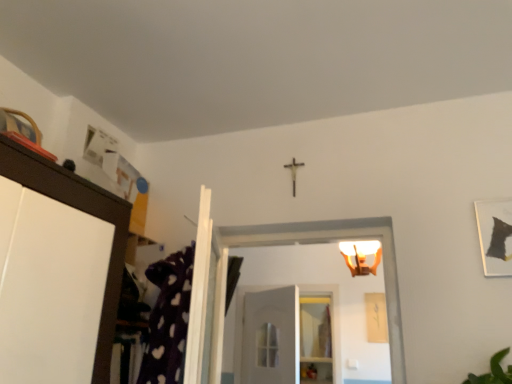
Question: Can you confirm if white matte door at center is wider than matte black picture frame at upper right?

Choices:
 (A) no
 (B) yes

Answer: (B)

Question: Can you see white matte door at center touching matte black picture frame at upper right?

Choices:
 (A) yes
 (B) no

Answer: (B)

Question: Does white matte door at center appear on the left side of matte black picture frame at upper right?

Choices:
 (A) no
 (B) yes

Answer: (B)

Question: From the image's perspective, does white matte door at center appear lower than matte black picture frame at upper right?

Choices:
 (A) no
 (B) yes

Answer: (B)

Question: Is white matte door at center smaller than matte black picture frame at upper right?

Choices:
 (A) yes
 (B) no

Answer: (B)

Question: Does white matte door at center have a lesser height compared to matte black picture frame at upper right?

Choices:
 (A) no
 (B) yes

Answer: (A)

Question: Does clear glass shelf at center have a greater height compared to matte black picture frame at upper right?

Choices:
 (A) yes
 (B) no

Answer: (A)

Question: Is clear glass shelf at center oriented away from matte black picture frame at upper right?

Choices:
 (A) yes
 (B) no

Answer: (B)

Question: Does clear glass shelf at center come behind matte black picture frame at upper right?

Choices:
 (A) yes
 (B) no

Answer: (A)

Question: Does clear glass shelf at center have a greater width compared to matte black picture frame at upper right?

Choices:
 (A) yes
 (B) no

Answer: (A)

Question: From a real-world perspective, is clear glass shelf at center under matte black picture frame at upper right?

Choices:
 (A) no
 (B) yes

Answer: (B)

Question: Is clear glass shelf at center to the right of matte black picture frame at upper right from the viewer's perspective?

Choices:
 (A) no
 (B) yes

Answer: (A)

Question: Is white matte door at center positioned behind matte white light fixture at upper center?

Choices:
 (A) yes
 (B) no

Answer: (A)